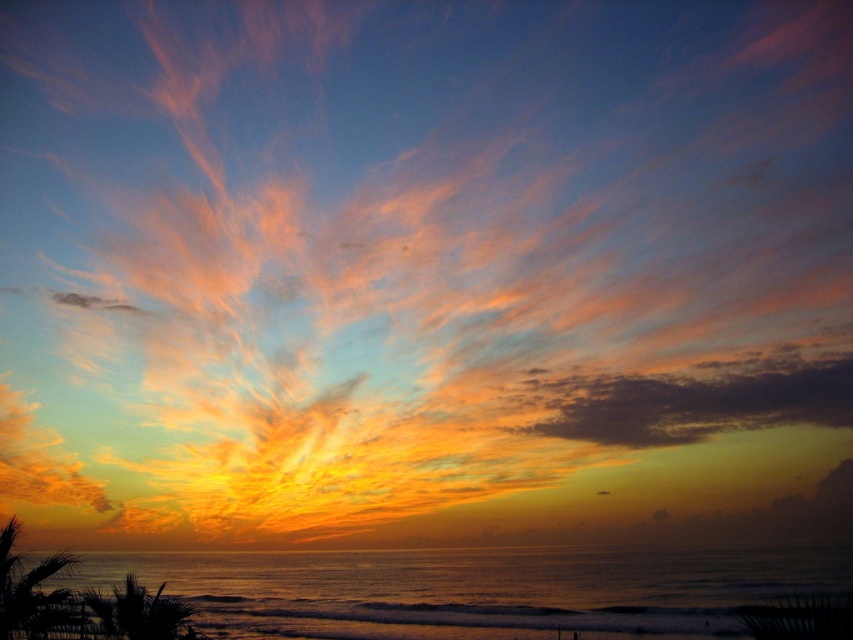
Is silvery water at lower center below dark orange textured clouds at upper right?

Yes, silvery water at lower center is below dark orange textured clouds at upper right.

Does silvery water at lower center have a greater height compared to dark orange textured clouds at upper right?

Indeed, silvery water at lower center has a greater height compared to dark orange textured clouds at upper right.

Between point (761, 557) and point (749, 420), which one is positioned behind?

Point (749, 420)

Identify the location of silvery water at lower center. Image resolution: width=853 pixels, height=640 pixels. (474, 589).